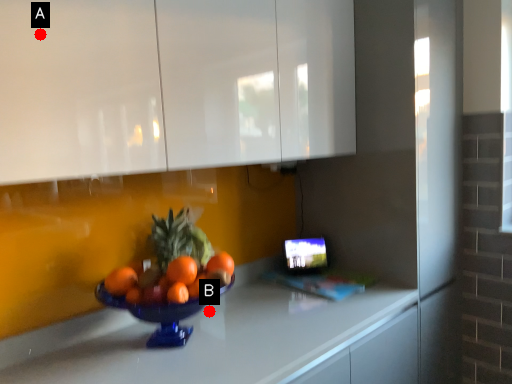
Question: Two points are circled on the image, labeled by A and B beside each circle. Which point appears closest to the camera in this image?

Choices:
 (A) A is closer
 (B) B is closer

Answer: (A)